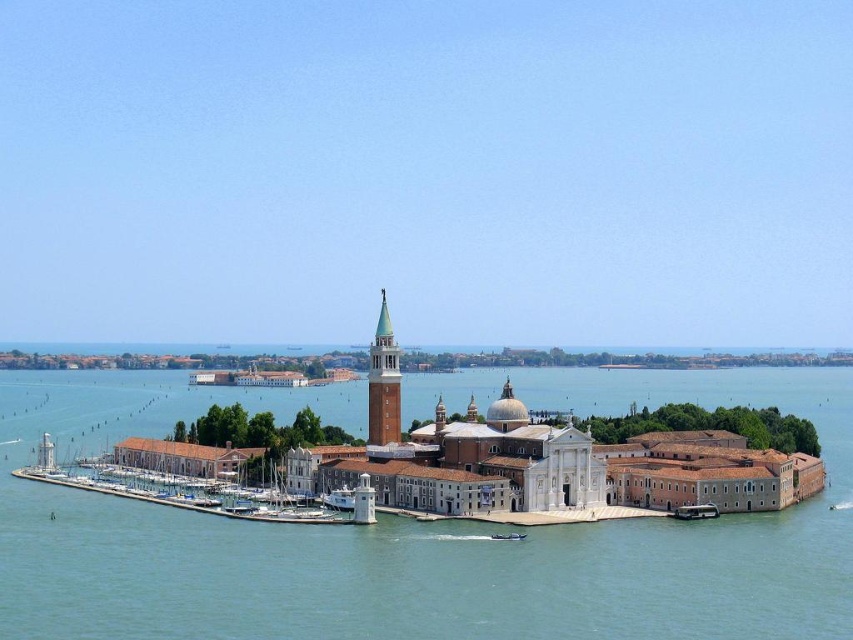
Question: Which of the following is the farthest from the observer?

Choices:
 (A) tap(509, 532)
 (B) tap(544, 381)
 (C) tap(20, 474)

Answer: (B)

Question: Which point is farther to the camera?

Choices:
 (A) clear blue water at center
 (B) white wooden dock at lower left

Answer: (B)

Question: Is greenish-brown stone tower at center thinner than metallic gray boat at lower center?

Choices:
 (A) no
 (B) yes

Answer: (A)

Question: Where is clear blue water at center located in relation to white plastic boat at lower right in the image?

Choices:
 (A) left
 (B) right

Answer: (A)

Question: Is clear blue water at center smaller than metallic gray boat at lower center?

Choices:
 (A) no
 (B) yes

Answer: (A)

Question: Among these points, which one is farthest from the camera?

Choices:
 (A) (700, 506)
 (B) (190, 483)
 (C) (614, 406)

Answer: (C)